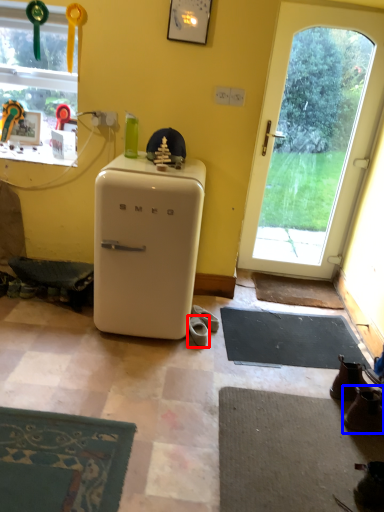
Question: Which point is further to the camera, footwear (highlighted by a red box) or footwear (highlighted by a blue box)?

Choices:
 (A) footwear
 (B) footwear

Answer: (A)